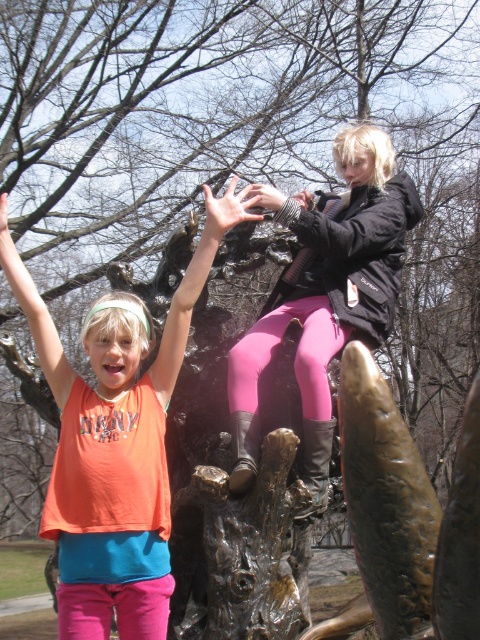
You are a photographer trying to capture a photo of the two children near the sculpture. You need to ensure that both the pink matte leggings at upper center and the orange fabric shirt at upper left are clearly visible in the frame. Based on their heights, which child should you focus on to ensure both are visible?

The pink matte leggings at upper center has a greater height compared to the orange fabric shirt at upper left, so focusing on the child with the pink matte leggings at upper center will ensure both are visible as they are positioned higher.

You are standing 5 meters away from the sculpture and want to take a photo of the point at coordinates point (238, 371). Is the point within your current range?

The distance of point (238, 371) from viewer is 6.37 meters, so the point is 1.37 meters beyond your current 5 meter range. You need to move closer to capture it.